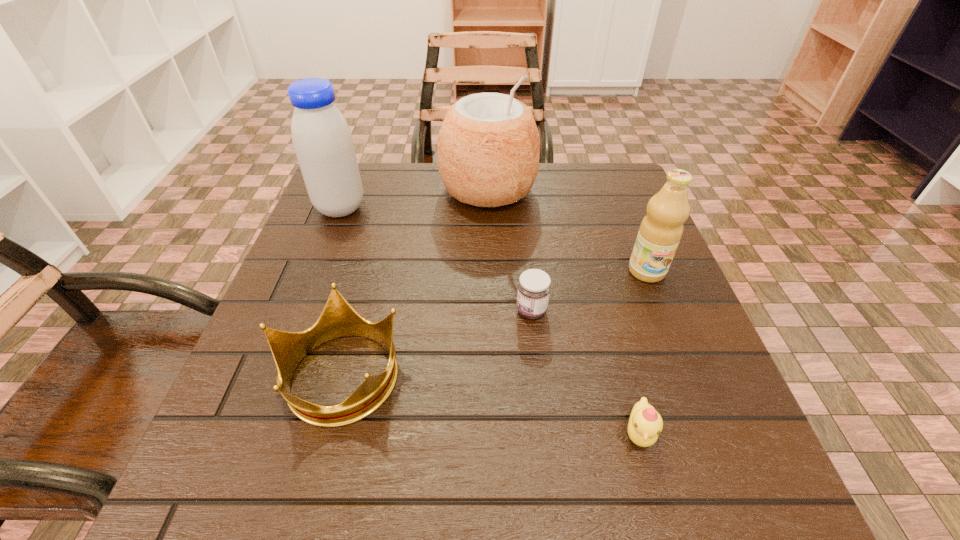
Where is `object that is the closest one to the fourth tallest object`? object that is the closest one to the fourth tallest object is located at coordinates (534, 287).